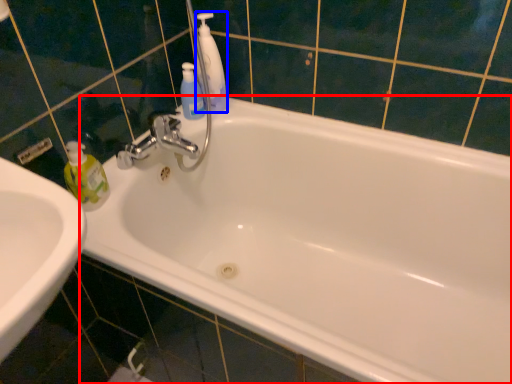
Question: Which object appears farthest to the camera in this image, bathtub (highlighted by a red box) or cleaning product (highlighted by a blue box)?

Choices:
 (A) bathtub
 (B) cleaning product

Answer: (B)